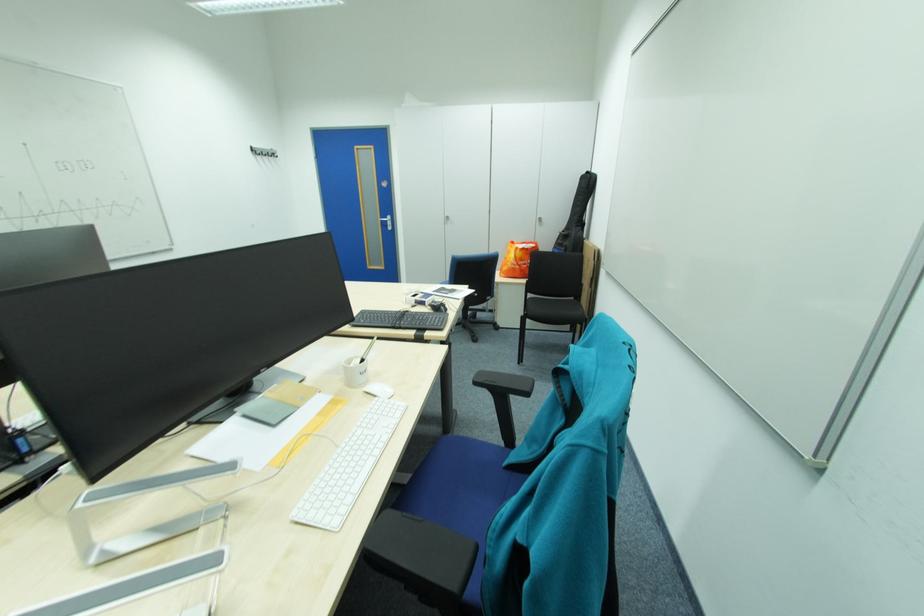
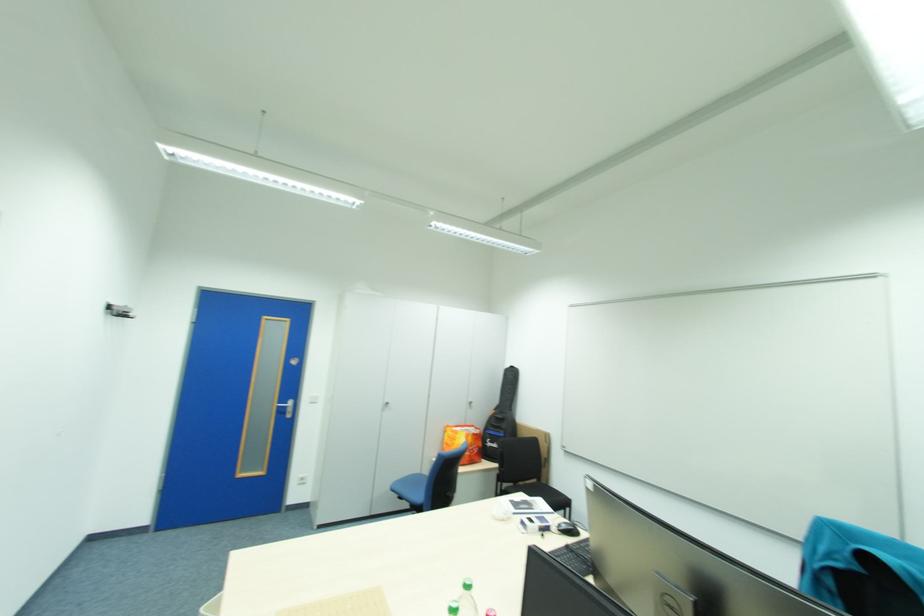
Locate, in the second image, the point that corresponds to [390,221] in the first image.

(286, 407)